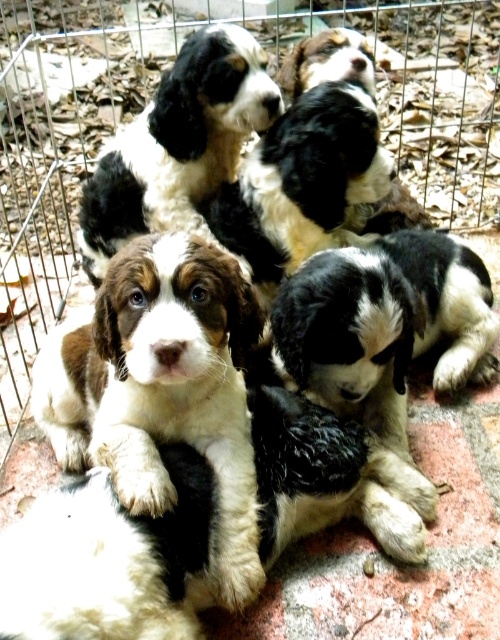
You are a dog trainer observing the puppies in the cage. You notice the metal wire fence at center and the soft fur puppy at center. Which object is located above the other?

The metal wire fence at center is positioned over the soft fur puppy at center.

You are a dog trainer observing the cage with puppies. There is a point marked at coordinates (147, 108). What object is located at that point?

The point at coordinates (147, 108) indicates the location of the metal wire fence at center.

You are a photographer standing near the cage with the puppies. You want to take a clear photo of the soft fur puppy at center without any blur. Considering the camera requires a minimum distance of 1 meter to focus properly, will you be able to take a clear photo?

The distance between the soft fur puppy at center and the camera is 98.15 centimeters, which is less than the required 1 meter. Therefore, the camera may not focus properly, resulting in a blurry photo.